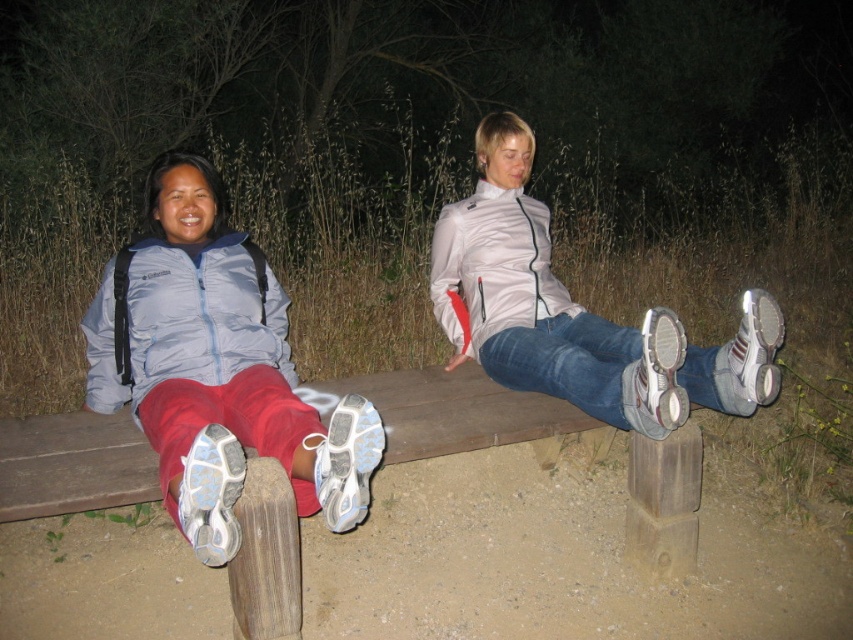
You are a photographer trying to capture a closeup of the matte blue jacket at left and the white matte sneakers at center. The camera you are using has a minimum focusing distance of 1 meter. Can you take the photo without moving either object?

The distance between the matte blue jacket at left and white matte sneakers at center is 96.07 centimeters. Since the minimum focusing distance is 1 meter, the camera cannot focus properly at this distance. You would need to move either object to increase the distance to at least 1 meter.

You are a photographer trying to capture a photo of the matte blue jacket at left and the white matte sneakers at center. From the photographer perspective, which object is located more to the left?

The matte blue jacket at left is more to the left than the white matte sneakers at center.